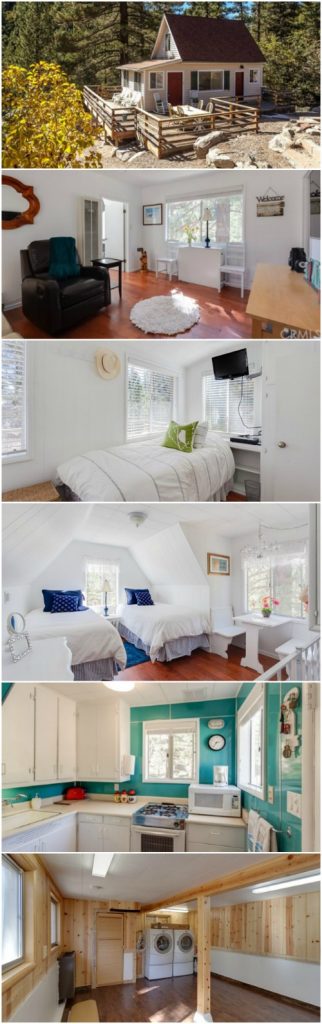
Where is `corners picture frame second image`? Image resolution: width=322 pixels, height=1024 pixels. corners picture frame second image is located at coordinates (161, 204), (142, 204), (144, 222), (162, 221).